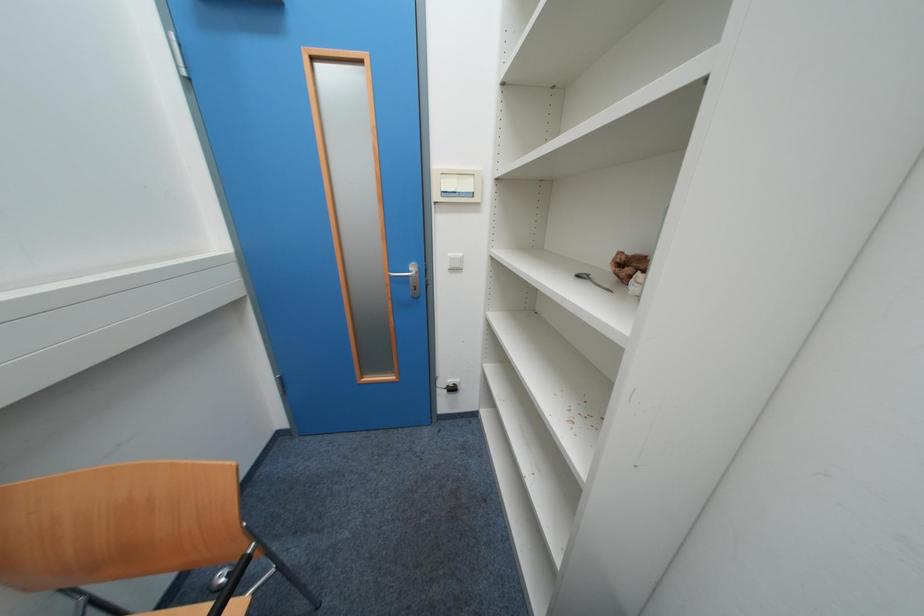
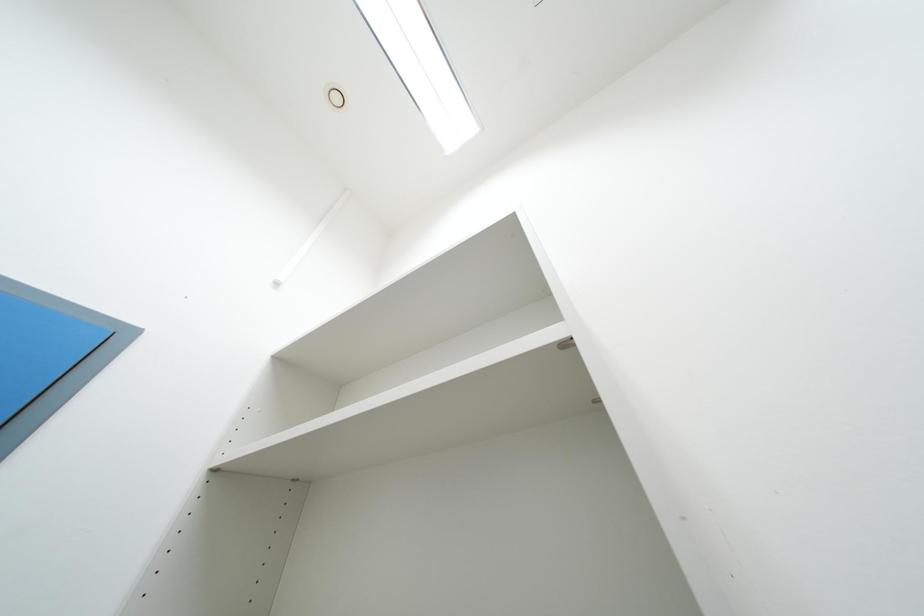
The images are taken continuously from a first-person perspective. In which direction is your viewpoint rotating?

The rotation direction of the camera is right-up.